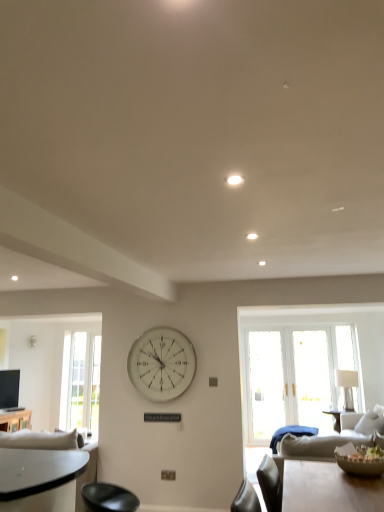
The height and width of the screenshot is (512, 384). What do you see at coordinates (15, 420) in the screenshot? I see `wooden table at lower left` at bounding box center [15, 420].

I want to click on white fabric lampshade at right, so click(x=347, y=386).

Describe the element at coordinates (235, 180) in the screenshot. I see `white glossy light at upper center` at that location.

Where is `white fabric couch at lower left`? This screenshot has width=384, height=512. white fabric couch at lower left is located at coordinates click(x=46, y=478).

Considering the positions of points (233, 183) and (348, 398), is point (233, 183) farther from camera compared to point (348, 398)?

No, (233, 183) is in front of (348, 398).

Is white fabric lampshade at right at the back of white glossy light at upper center?

No.

From a real-world perspective, which is physically below, white glossy light at upper center or white fabric lampshade at right?

white fabric lampshade at right.

Based on the photo, in terms of width, does clear glass door at left look wider or thinner when compared to white glossy light at upper center?

Considering their sizes, clear glass door at left looks broader than white glossy light at upper center.

From the image's perspective, is clear glass door at left over white glossy light at upper center?

No, from the image's perspective, clear glass door at left is not on top of white glossy light at upper center.

Where is `light in front of the clear glass door at left`? Image resolution: width=384 pixels, height=512 pixels. light in front of the clear glass door at left is located at coordinates (235, 180).

Is clear glass door at left located outside white glossy light at upper center?

That's correct, clear glass door at left is outside of white glossy light at upper center.

In the scene shown: Considering the sizes of clear glass door at left and white fabric lampshade at right in the image, is clear glass door at left taller or shorter than white fabric lampshade at right?

In the image, clear glass door at left appears to be taller than white fabric lampshade at right.

From a real-world perspective, relative to white fabric lampshade at right, is clear glass door at left vertically above or below?

clear glass door at left is above white fabric lampshade at right.

How far apart are clear glass door at left and white fabric lampshade at right?

clear glass door at left and white fabric lampshade at right are 10.88 feet apart.

Is clear glass door at left bigger than white fabric lampshade at right?

No, clear glass door at left is not bigger than white fabric lampshade at right.

Between white fabric couch at lower left and white glass clock at center, which one appears on the right side from the viewer's perspective?

white glass clock at center.

Based on the photo, is white fabric couch at lower left inside or outside of white glass clock at center?

white fabric couch at lower left is outside white glass clock at center.

Which is in front, point (83, 481) or point (176, 353)?

The point (83, 481) is closer.

Considering the relative positions of wooden table at lower left and white fabric couch at lower left in the image provided, is wooden table at lower left to the left or to the right of white fabric couch at lower left?

From the image, it's evident that wooden table at lower left is to the left of white fabric couch at lower left.

Is wooden table at lower left not near white fabric couch at lower left?

That's right, there is a large distance between wooden table at lower left and white fabric couch at lower left.

From the image's perspective, would you say wooden table at lower left is positioned over white fabric couch at lower left?

Incorrect, from the image's perspective, wooden table at lower left is lower than white fabric couch at lower left.

Is wooden table at lower left facing away from white fabric couch at lower left?

That's not correct — wooden table at lower left is not looking away from white fabric couch at lower left.

Based on the photo, can you confirm if white fabric couch at lower left is thinner than white glossy light at upper center?

In fact, white fabric couch at lower left might be wider than white glossy light at upper center.

Based on the photo, considering the relative sizes of white fabric couch at lower left and white glossy light at upper center in the image provided, is white fabric couch at lower left shorter than white glossy light at upper center?

Incorrect, the height of white fabric couch at lower left does not fall short of that of white glossy light at upper center.

Between white fabric couch at lower left and white glossy light at upper center, which one is positioned in front?

white glossy light at upper center is more forward.

Which is correct: white glass clock at center is inside white fabric lampshade at right, or outside of it?

white glass clock at center is spatially situated outside white fabric lampshade at right.

Could you tell me if white glass clock at center is turned towards white fabric lampshade at right?

No, white glass clock at center does not turn towards white fabric lampshade at right.

Does white glass clock at center appear on the left side of white fabric lampshade at right?

Indeed, white glass clock at center is positioned on the left side of white fabric lampshade at right.

Does white glass clock at center have a smaller size compared to white fabric lampshade at right?

Yes.

This screenshot has height=512, width=384. Find the location of `light above the white fabric lampshade at right (from a real-world perspective)`. light above the white fabric lampshade at right (from a real-world perspective) is located at coordinates click(x=235, y=180).

Locate an element on the screen. The image size is (384, 512). light that appears in front of the clear glass door at left is located at coordinates (235, 180).

Looking at the image, which one is located further to clear glass door at left, white fabric lampshade at right or wooden table at lower left?

The object further to clear glass door at left is white fabric lampshade at right.

Estimate the real-world distances between objects in this image. Which object is further from white fabric lampshade at right, white fabric couch at lower left or white glossy light at upper center?

white glossy light at upper center is further to white fabric lampshade at right.

Based on their spatial positions, is white fabric lampshade at right or clear glass door at left closer to white glossy light at upper center?

white fabric lampshade at right.

Based on their spatial positions, is white fabric lampshade at right or wooden table at lower left further from white glass clock at center?

wooden table at lower left is positioned further to the anchor white glass clock at center.

When comparing their distances from white fabric couch at lower left, does clear glass door at left or white glass clock at center seem further?

clear glass door at left.

From the image, which object appears to be farther from white glass clock at center, wooden table at lower left or white glossy light at upper center?

The object further to white glass clock at center is white glossy light at upper center.

From the image, which object appears to be farther from white glass clock at center, white fabric couch at lower left or white glossy light at upper center?

white glossy light at upper center is positioned further to the anchor white glass clock at center.

Looking at this image, when comparing their distances from white glossy light at upper center, does white glass clock at center or wooden table at lower left seem further?

wooden table at lower left is further to white glossy light at upper center.

The image size is (384, 512). What are the coordinates of `table between white glossy light at upper center and clear glass door at left along the z-axis` in the screenshot? It's located at (15, 420).

Find the location of a particular element. wall clock located between clear glass door at left and white fabric lampshade at right in the left-right direction is located at coordinates (162, 364).

The image size is (384, 512). Find the location of `table positioned between white fabric couch at lower left and clear glass door at left from near to far`. table positioned between white fabric couch at lower left and clear glass door at left from near to far is located at coordinates (15, 420).

At what (x,y) coordinates should I click in order to perform the action: click on wall clock between white fabric couch at lower left and white fabric lampshade at right from left to right. Please return your answer as a coordinate pair (x, y). The image size is (384, 512). Looking at the image, I should click on (162, 364).